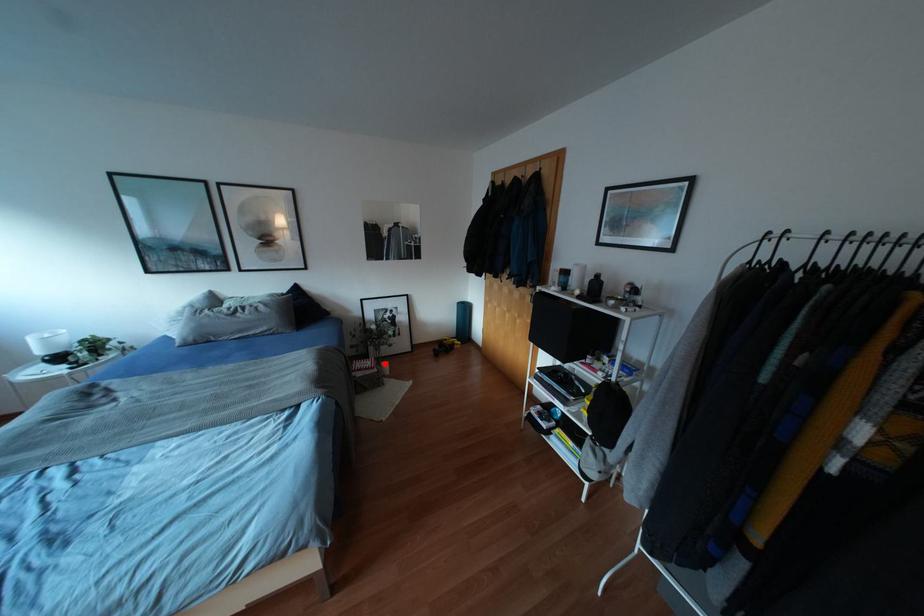
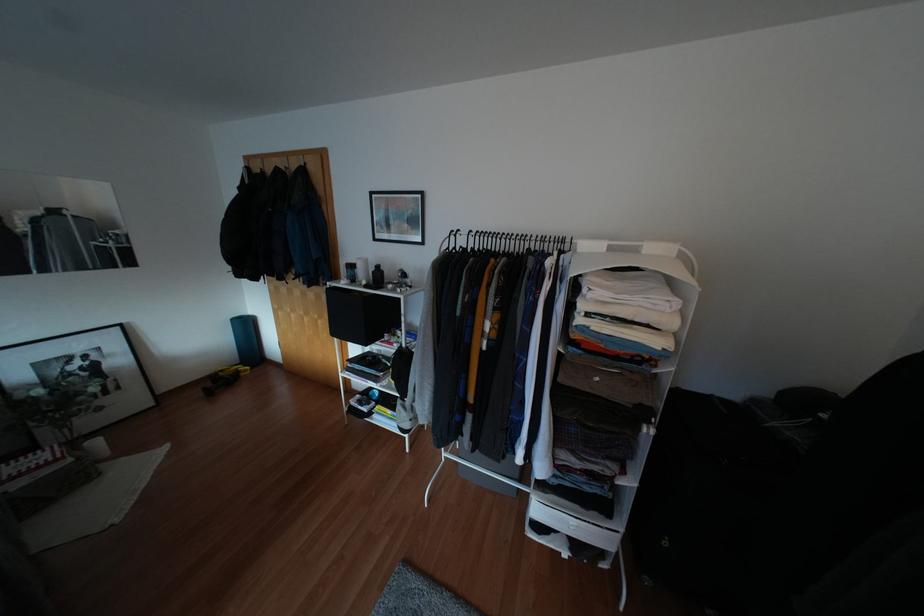
The point at the highlighted location is marked in the first image. Where is the corresponding point in the second image?

(94, 442)